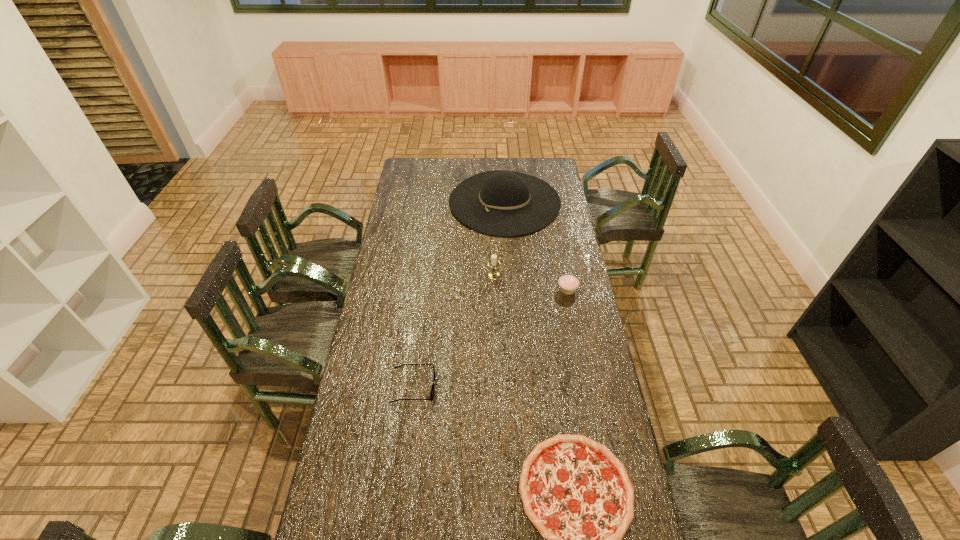
At what (x,y) coordinates should I click in order to perform the action: click on object identified as the second closest to the pizza. Please return your answer as a coordinate pair (x, y). The width and height of the screenshot is (960, 540). Looking at the image, I should click on (568, 284).

Find the location of a particular element. Image resolution: width=960 pixels, height=540 pixels. free location that satisfies the following two spatial constraints: 1. on the front-facing side of the tallest object; 2. on the back side of the third farthest object is located at coordinates (511, 289).